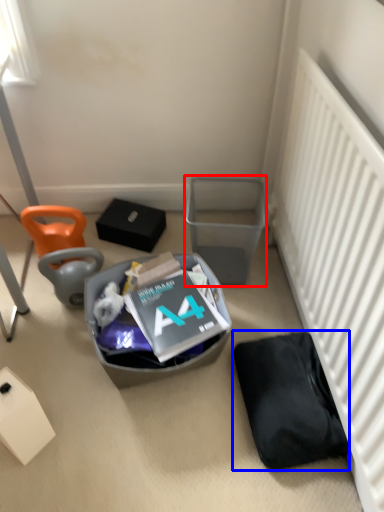
Question: Which object appears closest to the camera in this image, trash bin/can (highlighted by a red box) or wide (highlighted by a blue box)?

Choices:
 (A) trash bin/can
 (B) wide

Answer: (B)